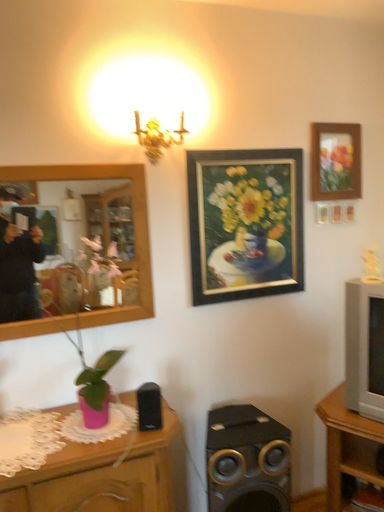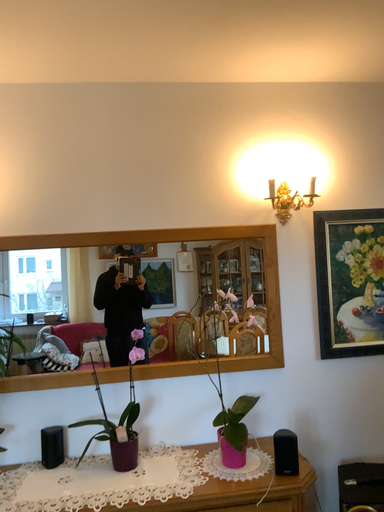
Question: How did the camera likely rotate when shooting the video?

Choices:
 (A) rotated upward
 (B) rotated downward

Answer: (A)